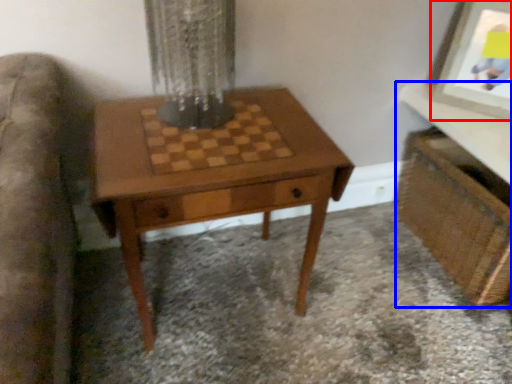
Question: Among these objects, which one is nearest to the camera, picture frame (highlighted by a red box) or vanity (highlighted by a blue box)?

Choices:
 (A) picture frame
 (B) vanity

Answer: (B)